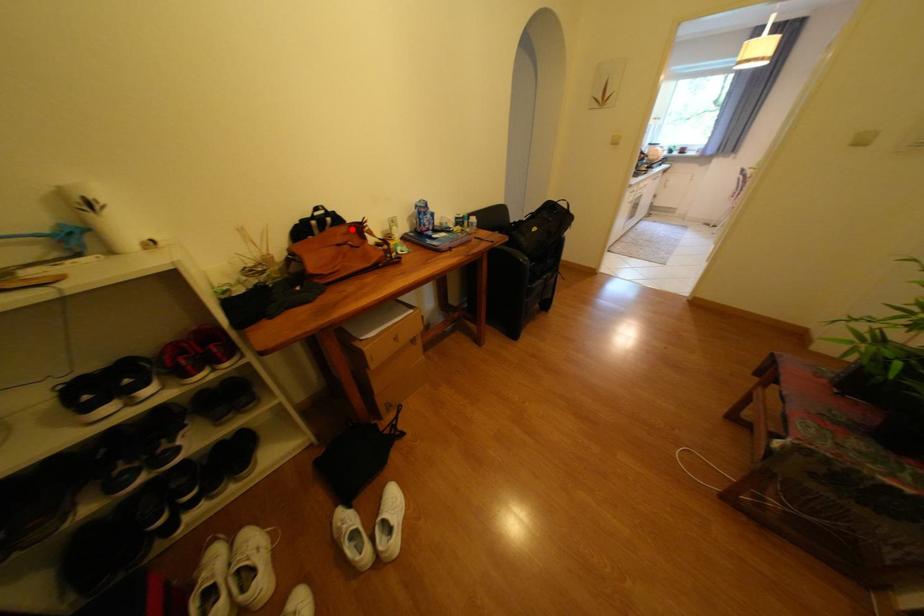
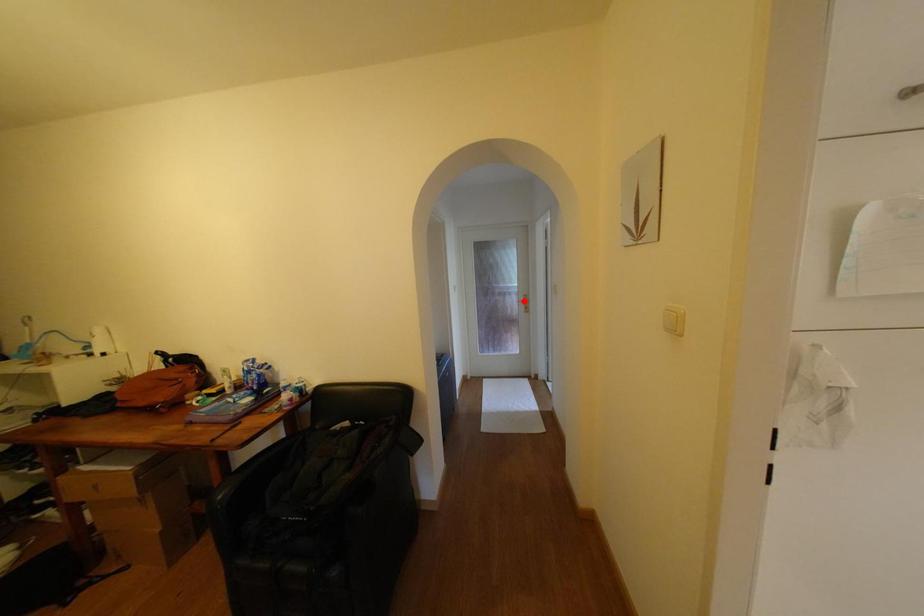
I am providing you with two images of the same scene from different viewpoints. A red point is marked on the first image and another point is marked on the second image. Do the highlighted points in image1 and image2 indicate the same real-world spot?

No